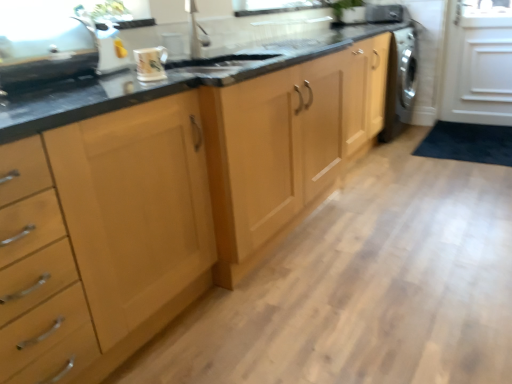
Question: Is green leafy plant at upper center at the right side of glossy ceramic mug at upper center?

Choices:
 (A) yes
 (B) no

Answer: (A)

Question: Can we say green leafy plant at upper center lies outside glossy ceramic mug at upper center?

Choices:
 (A) yes
 (B) no

Answer: (A)

Question: Considering the relative sizes of green leafy plant at upper center and glossy ceramic mug at upper center in the image provided, is green leafy plant at upper center bigger than glossy ceramic mug at upper center?

Choices:
 (A) no
 (B) yes

Answer: (B)

Question: Is green leafy plant at upper center smaller than glossy ceramic mug at upper center?

Choices:
 (A) no
 (B) yes

Answer: (A)

Question: From the image's perspective, is green leafy plant at upper center on glossy ceramic mug at upper center?

Choices:
 (A) no
 (B) yes

Answer: (B)

Question: From a real-world perspective, is green leafy plant at upper center on top of glossy ceramic mug at upper center?

Choices:
 (A) no
 (B) yes

Answer: (B)

Question: Is satin silver dishwasher at right, which ranks as the 1th appliance in right-to-left order, outside metallic silver kettle at upper left, the 2th appliance in the top-to-bottom sequence?

Choices:
 (A) no
 (B) yes

Answer: (B)

Question: Can you confirm if satin silver dishwasher at right, which is counted as the 1th appliance, starting from the top, is smaller than metallic silver kettle at upper left, placed as the 2th appliance when sorted from left to right?

Choices:
 (A) no
 (B) yes

Answer: (B)

Question: Is satin silver dishwasher at right, the 3th appliance viewed from the left, surrounding metallic silver kettle at upper left, the 2th appliance in the top-to-bottom sequence?

Choices:
 (A) no
 (B) yes

Answer: (A)

Question: Is satin silver dishwasher at right, the 3th appliance viewed from the front, behind metallic silver kettle at upper left, the 2th appliance in the bottom-to-top sequence?

Choices:
 (A) yes
 (B) no

Answer: (A)

Question: Does satin silver dishwasher at right, the 3th appliance viewed from the front, turn towards metallic silver kettle at upper left, the second appliance viewed from the front?

Choices:
 (A) no
 (B) yes

Answer: (B)

Question: Does satin silver dishwasher at right, the 3th appliance viewed from the front, appear on the right side of metallic silver kettle at upper left, the 2th appliance in the bottom-to-top sequence?

Choices:
 (A) no
 (B) yes

Answer: (B)

Question: Is metallic silver kettle at upper left, the second appliance viewed from the right, not close to glossy ceramic mug at upper center?

Choices:
 (A) yes
 (B) no

Answer: (B)